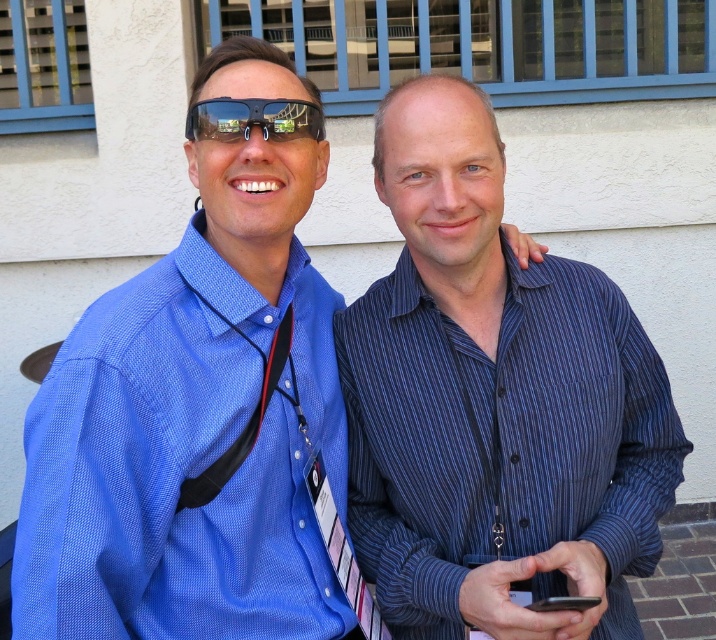
You are standing in front of the building and want to determine which of the two points, point (x=145, y=449) or point (x=589, y=595), is nearer to you. Based on the scene description, which point is closer?

Point (x=145, y=449) is closer to the viewer than point (x=589, y=595).

You are a photographer trying to capture a clear picture of both the blue striped shirt at center and the black matte smartphone at lower center. Which object should you focus on first to ensure it appears sharp in the photo?

The blue striped shirt at center is further to the viewer than the black matte smartphone at lower center. To ensure both appear sharp, focus on the blue striped shirt at center first since it is closer, and the depth of field may naturally include the smartphone behind it.